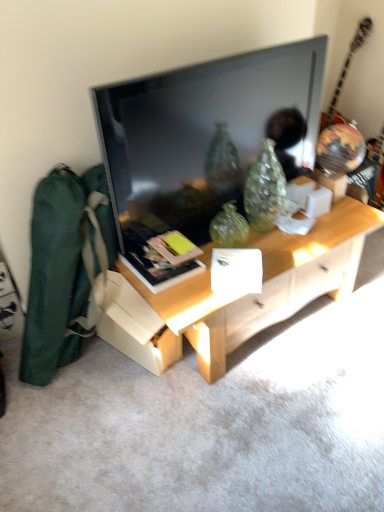
Image resolution: width=384 pixels, height=512 pixels. Identify the location of flat screen tv at center. (204, 132).

Can you confirm if glossy wood guitar at upper right is smaller than light wood desk at center?

Yes, glossy wood guitar at upper right is smaller than light wood desk at center.

Is glossy wood guitar at upper right positioned far away from light wood desk at center?

Yes, glossy wood guitar at upper right and light wood desk at center are located far from each other.

Is glossy wood guitar at upper right turned away from light wood desk at center?

That's not correct — glossy wood guitar at upper right is not looking away from light wood desk at center.

Considering the sizes of glossy wood guitar at upper right and light wood desk at center in the image, is glossy wood guitar at upper right taller or shorter than light wood desk at center?

Considering their sizes, glossy wood guitar at upper right has more height than light wood desk at center.

Considering the positions of objects glossy wood guitar at upper right and flat screen tv at center in the image provided, who is more to the right, glossy wood guitar at upper right or flat screen tv at center?

glossy wood guitar at upper right.

In terms of width, does glossy wood guitar at upper right look wider or thinner when compared to flat screen tv at center?

glossy wood guitar at upper right is wider than flat screen tv at center.

Between glossy wood guitar at upper right and flat screen tv at center, which one has smaller size?

flat screen tv at center.

Identify the location of guitar that is above the flat screen tv at center (from the image's perspective). (346, 71).

Is the depth of green canvas messenger bag at left less than that of glossy wood guitar at upper right?

That is True.

Is green canvas messenger bag at left to the left or to the right of glossy wood guitar at upper right in the image?

From the image, it's evident that green canvas messenger bag at left is to the left of glossy wood guitar at upper right.

Is green canvas messenger bag at left looking in the opposite direction of glossy wood guitar at upper right?

No, green canvas messenger bag at left is not facing the opposite direction of glossy wood guitar at upper right.

In terms of height, does green canvas messenger bag at left look taller or shorter compared to glossy wood guitar at upper right?

Clearly, green canvas messenger bag at left is taller compared to glossy wood guitar at upper right.

Between flat screen tv at center and glossy wood guitar at upper right, which one has smaller size?

flat screen tv at center is smaller.

Considering the positions of points (295, 50) and (347, 64), is point (295, 50) farther from camera compared to point (347, 64)?

That is False.

Does flat screen tv at center have a greater width compared to glossy wood guitar at upper right?

In fact, flat screen tv at center might be narrower than glossy wood guitar at upper right.

How different are the orientations of flat screen tv at center and glossy wood guitar at upper right in degrees?

97.2 degrees.

Does flat screen tv at center appear on the right side of matte black book at center?

Yes.

From the image's perspective, is flat screen tv at center located beneath matte black book at center?

Actually, flat screen tv at center appears above matte black book at center in the image.

Are flat screen tv at center and matte black book at center beside each other?

No, flat screen tv at center is not making contact with matte black book at center.

Is matte black book at center oriented towards light wood desk at center?

Yes, matte black book at center is aimed at light wood desk at center.

Who is bigger, matte black book at center or light wood desk at center?

light wood desk at center is bigger.

From a real-world perspective, relative to light wood desk at center, is matte black book at center vertically above or below?

In terms of real-world spatial position, matte black book at center is above light wood desk at center.

Is point (157, 265) positioned behind point (214, 295)?

Yes, point (157, 265) is farther from viewer.

How much distance is there between glossy wood guitar at upper right and green canvas messenger bag at left?

A distance of 6.69 feet exists between glossy wood guitar at upper right and green canvas messenger bag at left.

From a real-world perspective, is glossy wood guitar at upper right physically below green canvas messenger bag at left?

No, from a real-world perspective, glossy wood guitar at upper right is not under green canvas messenger bag at left.

Is glossy wood guitar at upper right located outside green canvas messenger bag at left?

That's correct, glossy wood guitar at upper right is outside of green canvas messenger bag at left.

Can you confirm if glossy wood guitar at upper right is positioned to the right of green canvas messenger bag at left?

Indeed, glossy wood guitar at upper right is positioned on the right side of green canvas messenger bag at left.

At what (x,y) coordinates should I click in order to perform the action: click on guitar located on the right of light wood desk at center. Please return your answer as a coordinate pair (x, y). The height and width of the screenshot is (512, 384). Looking at the image, I should click on [x=346, y=71].

Where is `guitar that is above the flat screen tv at center (from the image's perspective)`? guitar that is above the flat screen tv at center (from the image's perspective) is located at coordinates (346, 71).

Which object lies further to the anchor point green canvas messenger bag at left, glossy wood guitar at upper right or light wood desk at center?

Among the two, glossy wood guitar at upper right is located further to green canvas messenger bag at left.

Considering their positions, is green canvas messenger bag at left positioned closer to flat screen tv at center than matte black book at center?

Based on the image, matte black book at center appears to be nearer to flat screen tv at center.

From the image, which object appears to be farther from light wood desk at center, flat screen tv at center or matte black book at center?

flat screen tv at center is further to light wood desk at center.

When comparing their distances from matte black book at center, does glossy wood guitar at upper right or green canvas messenger bag at left seem closer?

green canvas messenger bag at left is positioned closer to the anchor matte black book at center.

When comparing their distances from glossy wood guitar at upper right, does flat screen tv at center or matte black book at center seem closer?

flat screen tv at center is closer to glossy wood guitar at upper right.

When comparing their distances from glossy wood guitar at upper right, does matte black book at center or light wood desk at center seem closer?

The object closer to glossy wood guitar at upper right is light wood desk at center.

Looking at the image, which one is located further to flat screen tv at center, light wood desk at center or glossy wood guitar at upper right?

glossy wood guitar at upper right.

Which object lies nearer to the anchor point matte black book at center, green canvas messenger bag at left or glossy wood guitar at upper right?

green canvas messenger bag at left is positioned closer to the anchor matte black book at center.

Find the location of a particular element. television between green canvas messenger bag at left and glossy wood guitar at upper right in the horizontal direction is located at coordinates (204, 132).

You are a GUI agent. You are given a task and a screenshot of the screen. Output one action in this format:
    pyautogui.click(x=<x>, y=<y>)
    Task: Click on the desk between green canvas messenger bag at left and glossy wood guitar at upper right
    The width and height of the screenshot is (384, 512).
    Given the screenshot: What is the action you would take?
    pyautogui.click(x=239, y=298)

The width and height of the screenshot is (384, 512). What are the coordinates of `book between green canvas messenger bag at left and glossy wood guitar at upper right in the horizontal direction` in the screenshot? It's located at (153, 260).

Where is `book between green canvas messenger bag at left and flat screen tv at center`? book between green canvas messenger bag at left and flat screen tv at center is located at coordinates (153, 260).